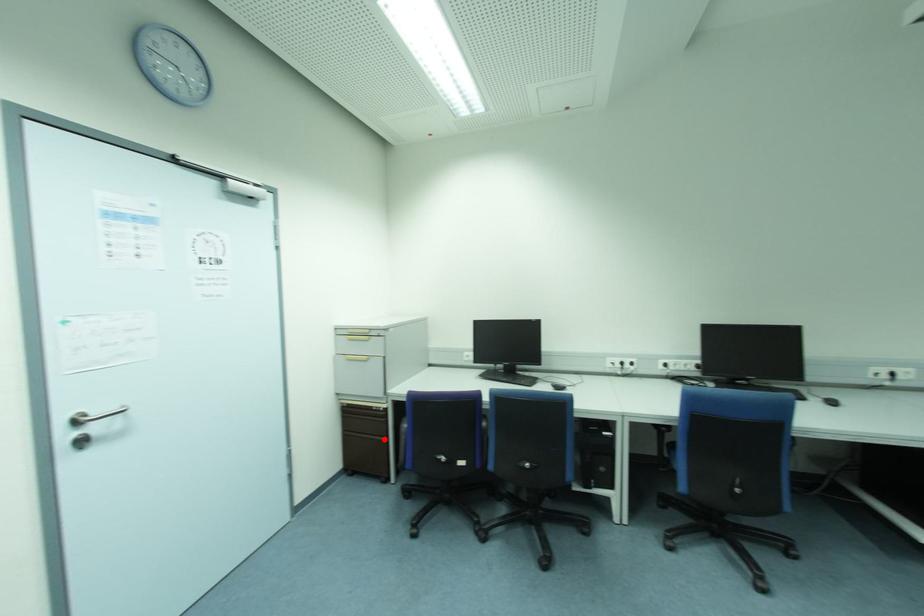
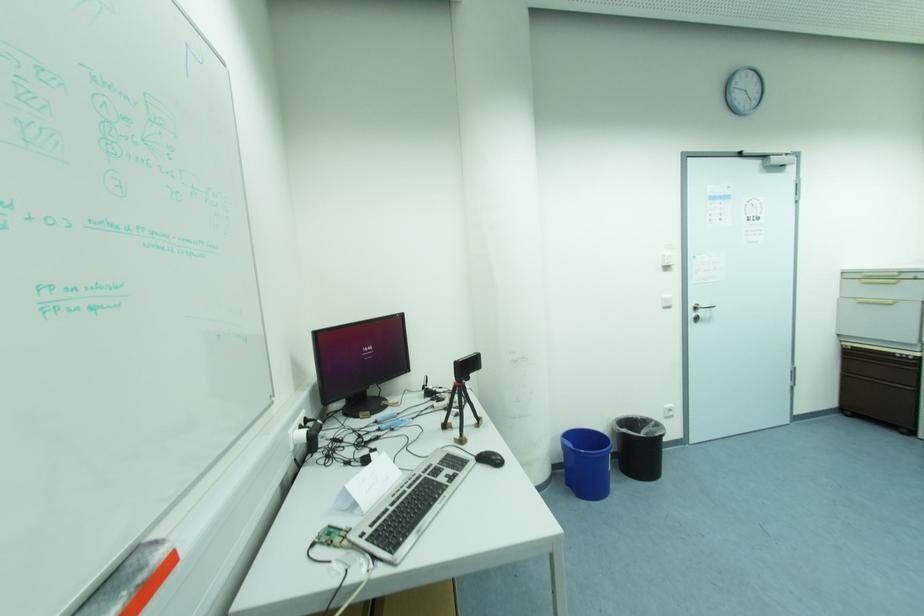
The point at the highlighted location is marked in the first image. Where is the corresponding point in the second image?

(910, 387)